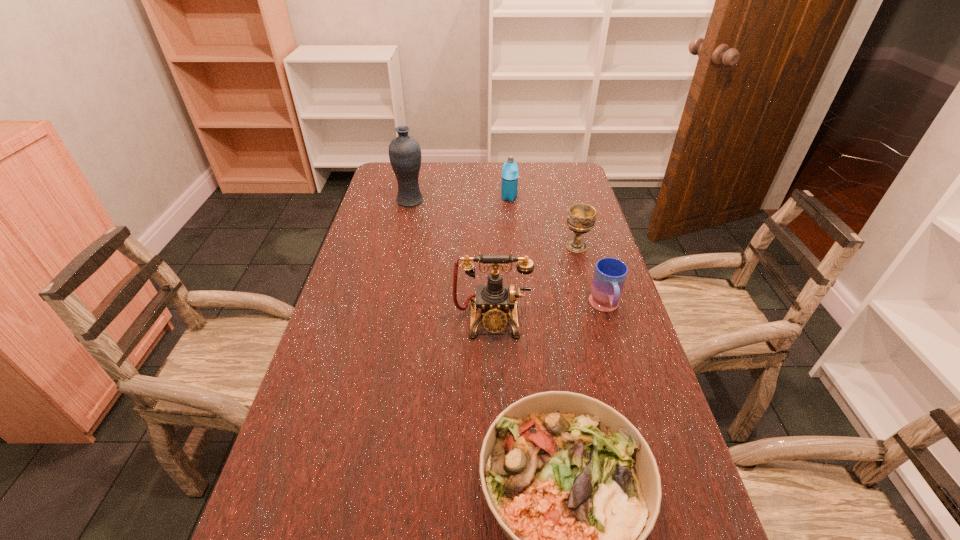
The image size is (960, 540). I want to click on free location located on the side of the mug with the handle, so click(x=619, y=354).

At what (x,y) coordinates should I click in order to perform the action: click on object that is at the left edge. Please return your answer as a coordinate pair (x, y). This screenshot has width=960, height=540. Looking at the image, I should click on (404, 151).

Where is `chalice located at the right edge`? Image resolution: width=960 pixels, height=540 pixels. chalice located at the right edge is located at coordinates (581, 218).

Locate an element on the screen. Image resolution: width=960 pixels, height=540 pixels. mug that is at the right edge is located at coordinates (610, 274).

In the image, there is a desktop. Identify the location of vacant space at the far edge. Image resolution: width=960 pixels, height=540 pixels. coord(533,173).

In the image, there is a desktop. Identify the location of free space at the left edge. (404, 208).

This screenshot has width=960, height=540. In the image, there is a desktop. Find the location of `vacant region at the right edge`. vacant region at the right edge is located at coordinates (571, 195).

This screenshot has width=960, height=540. In the image, there is a desktop. In order to click on vacant space at the far right corner in this screenshot , I will do `click(546, 180)`.

Where is `vacant area that lies between the third tallest object and the mug`? Image resolution: width=960 pixels, height=540 pixels. vacant area that lies between the third tallest object and the mug is located at coordinates (557, 253).

This screenshot has width=960, height=540. What are the coordinates of `empty space between the chalice and the telephone` in the screenshot? It's located at tap(534, 284).